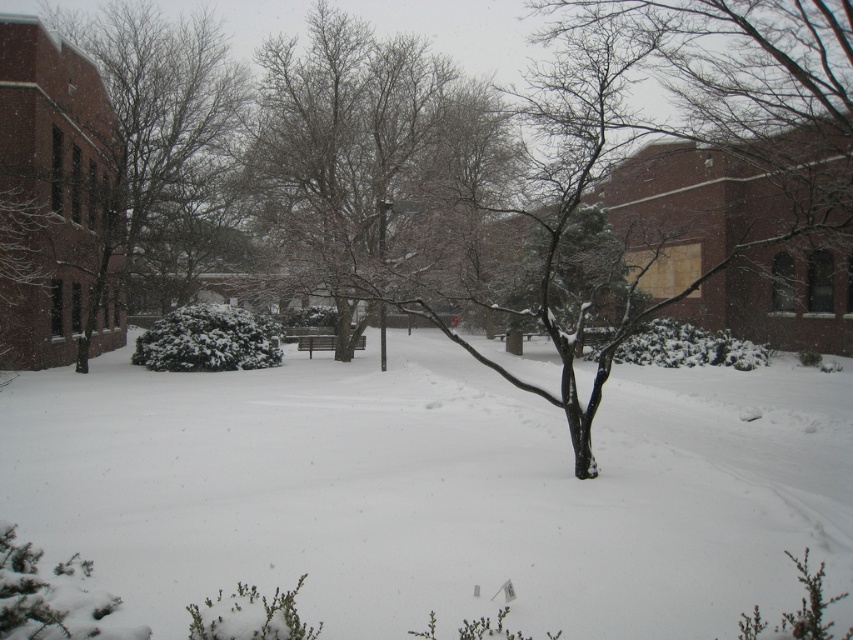
Question: Can you confirm if snow-covered tree at left is positioned below snow-covered tree at center?

Choices:
 (A) yes
 (B) no

Answer: (A)

Question: Which object appears closest to the camera in this image?

Choices:
 (A) snow-covered tree at center
 (B) snow-covered tree at left
 (C) white fluffy snow at center

Answer: (C)

Question: Is snow-covered tree at left above snow-covered tree at center?

Choices:
 (A) yes
 (B) no

Answer: (B)

Question: Does white fluffy snow at center have a smaller size compared to snow-covered tree at left?

Choices:
 (A) no
 (B) yes

Answer: (B)

Question: Which point appears closest to the camera in this image?

Choices:
 (A) (399, 136)
 (B) (373, 548)
 (C) (96, 257)

Answer: (B)

Question: Among these objects, which one is farthest from the camera?

Choices:
 (A) snow-covered tree at center
 (B) snow-covered tree at left
 (C) white fluffy snow at center

Answer: (B)